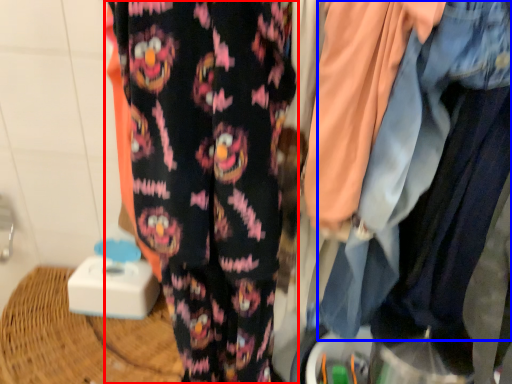
Question: Which point is further to the camera, trousers (highlighted by a red box) or denim jacket (highlighted by a blue box)?

Choices:
 (A) trousers
 (B) denim jacket

Answer: (A)